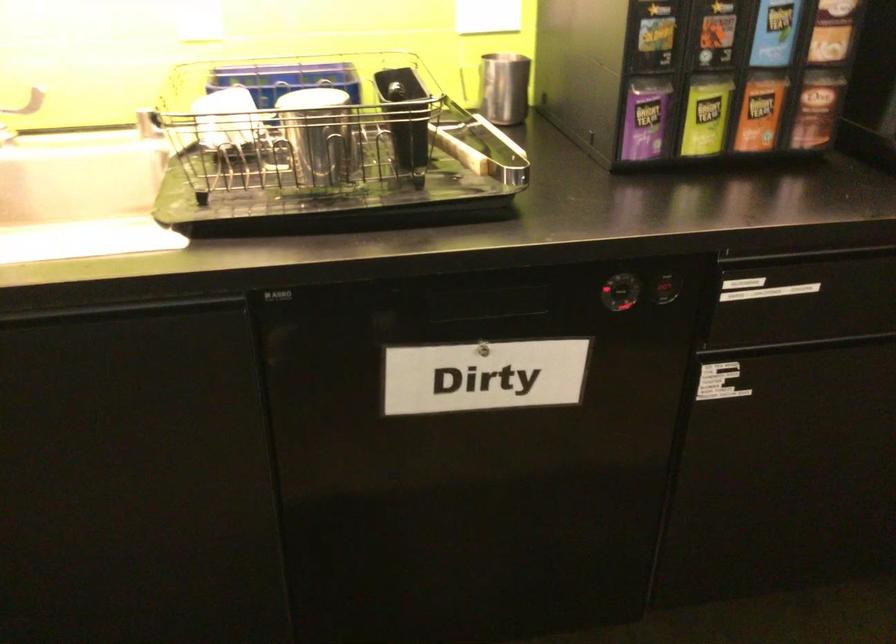
The height and width of the screenshot is (644, 896). What do you see at coordinates (623, 290) in the screenshot?
I see `the dishwasher dial` at bounding box center [623, 290].